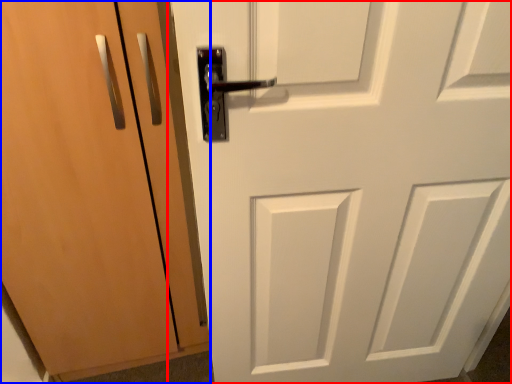
Question: Which of the following is the farthest to the observer, door (highlighted by a red box) or door (highlighted by a blue box)?

Choices:
 (A) door
 (B) door

Answer: (B)